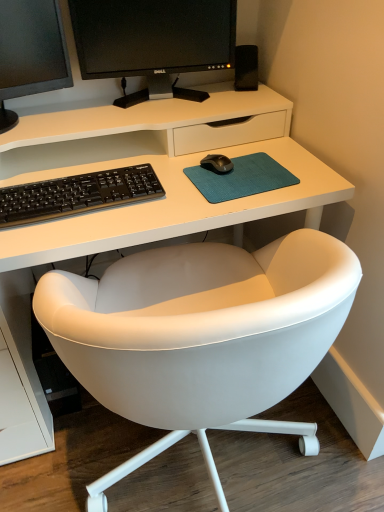
Where is `vacant region above teal fabric mousepad at center (from a real-world perspective)`? The height and width of the screenshot is (512, 384). vacant region above teal fabric mousepad at center (from a real-world perspective) is located at coordinates (247, 170).